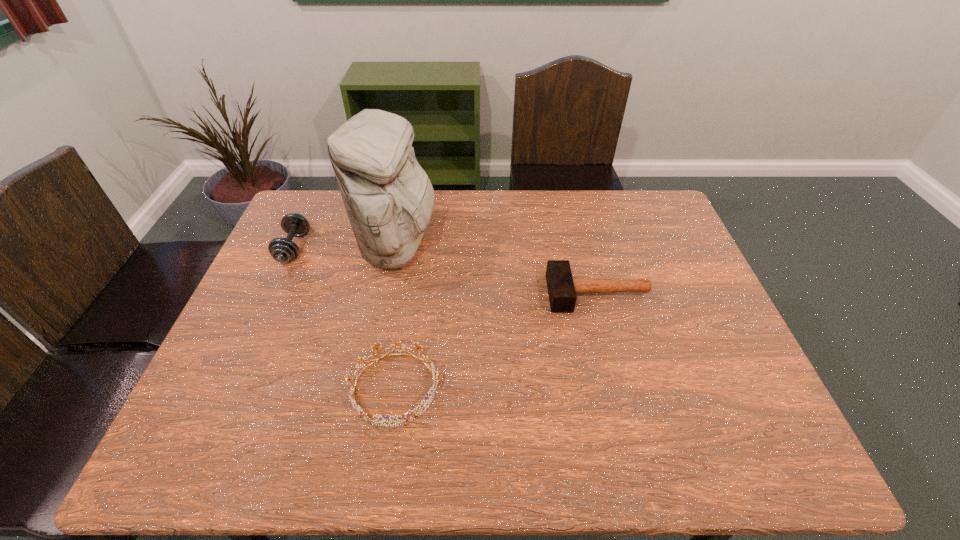
Where is `vacant space at the far left corner of the desktop`? vacant space at the far left corner of the desktop is located at coordinates (299, 197).

Image resolution: width=960 pixels, height=540 pixels. I want to click on free location at the near left corner of the desktop, so click(x=233, y=451).

Find the location of a particular element. The image size is (960, 540). free space at the near right corner of the desktop is located at coordinates (732, 436).

In order to click on vacant point located between the backpack and the dumbbell in this screenshot , I will do `click(346, 247)`.

Locate an element on the screen. The image size is (960, 540). free space that is in between the mallet and the nearest object is located at coordinates (496, 341).

Identify the location of vacant space that's between the second tallest object and the tiara. (345, 318).

Locate an element on the screen. empty space between the leftmost object and the tiara is located at coordinates (345, 318).

Where is `free spot between the rightmost object and the tallest object`? This screenshot has width=960, height=540. free spot between the rightmost object and the tallest object is located at coordinates (498, 270).

I want to click on vacant area that lies between the tallest object and the dumbbell, so click(x=346, y=247).

I want to click on vacant area that lies between the tallest object and the nearest object, so click(x=396, y=318).